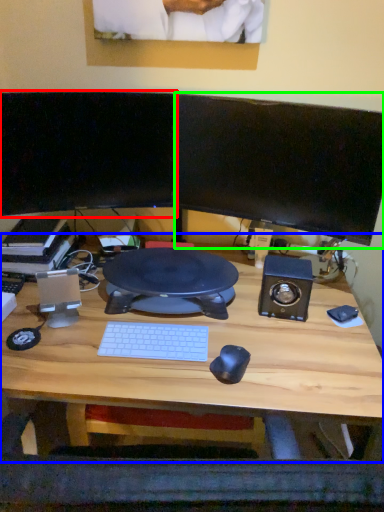
Question: Based on their relative distances, which object is nearer to computer monitor (highlighted by a red box)? Choose from desk (highlighted by a blue box) and computer monitor (highlighted by a green box).

Choices:
 (A) desk
 (B) computer monitor

Answer: (B)